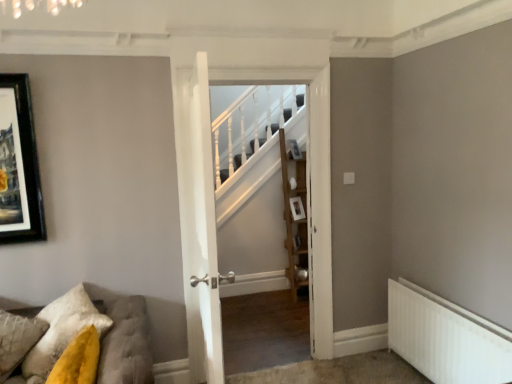
Question: Is tufted fabric sofa at lower left facing towards white wooden door at center, which is counted as the 2th door, starting from the front?

Choices:
 (A) no
 (B) yes

Answer: (A)

Question: Does tufted fabric sofa at lower left have a larger size compared to white wooden door at center, which is the 1th door in back-to-front order?

Choices:
 (A) no
 (B) yes

Answer: (B)

Question: Does tufted fabric sofa at lower left appear on the left side of white wooden door at center, which is the 1th door in back-to-front order?

Choices:
 (A) yes
 (B) no

Answer: (A)

Question: Considering the relative sizes of tufted fabric sofa at lower left and white wooden door at center, which is the 1th door in back-to-front order, in the image provided, is tufted fabric sofa at lower left wider than white wooden door at center, which is the 1th door in back-to-front order,?

Choices:
 (A) no
 (B) yes

Answer: (B)

Question: From a real-world perspective, is tufted fabric sofa at lower left beneath white wooden door at center, which is the 1th door in back-to-front order?

Choices:
 (A) yes
 (B) no

Answer: (A)

Question: From the image's perspective, is tufted fabric sofa at lower left above or below white wooden door at center, the 1th door when ordered from front to back?

Choices:
 (A) below
 (B) above

Answer: (A)

Question: Choose the correct answer: Is tufted fabric sofa at lower left inside white wooden door at center, which ranks as the second door in back-to-front order, or outside it?

Choices:
 (A) inside
 (B) outside

Answer: (B)

Question: From a real-world perspective, is tufted fabric sofa at lower left above or below white wooden door at center, which ranks as the second door in back-to-front order?

Choices:
 (A) above
 (B) below

Answer: (B)

Question: Is tufted fabric sofa at lower left bigger or smaller than white wooden door at center, which ranks as the second door in back-to-front order?

Choices:
 (A) small
 (B) big

Answer: (B)

Question: From the image's perspective, is textured yellow pillow at lower left positioned above or below white metallic radiator at lower right?

Choices:
 (A) below
 (B) above

Answer: (B)

Question: Considering the positions of textured yellow pillow at lower left and white metallic radiator at lower right in the image, is textured yellow pillow at lower left bigger or smaller than white metallic radiator at lower right?

Choices:
 (A) small
 (B) big

Answer: (B)

Question: From a real-world perspective, is textured yellow pillow at lower left physically located above or below white metallic radiator at lower right?

Choices:
 (A) above
 (B) below

Answer: (A)

Question: Is textured yellow pillow at lower left spatially inside white metallic radiator at lower right, or outside of it?

Choices:
 (A) inside
 (B) outside

Answer: (B)

Question: Considering the relative positions of white wooden door at center, which ranks as the second door in back-to-front order, and wooden shelf at center in the image provided, is white wooden door at center, which ranks as the second door in back-to-front order, to the left or to the right of wooden shelf at center?

Choices:
 (A) left
 (B) right

Answer: (A)

Question: From the image's perspective, is white wooden door at center, the 1th door when ordered from front to back, above or below wooden shelf at center?

Choices:
 (A) below
 (B) above

Answer: (A)